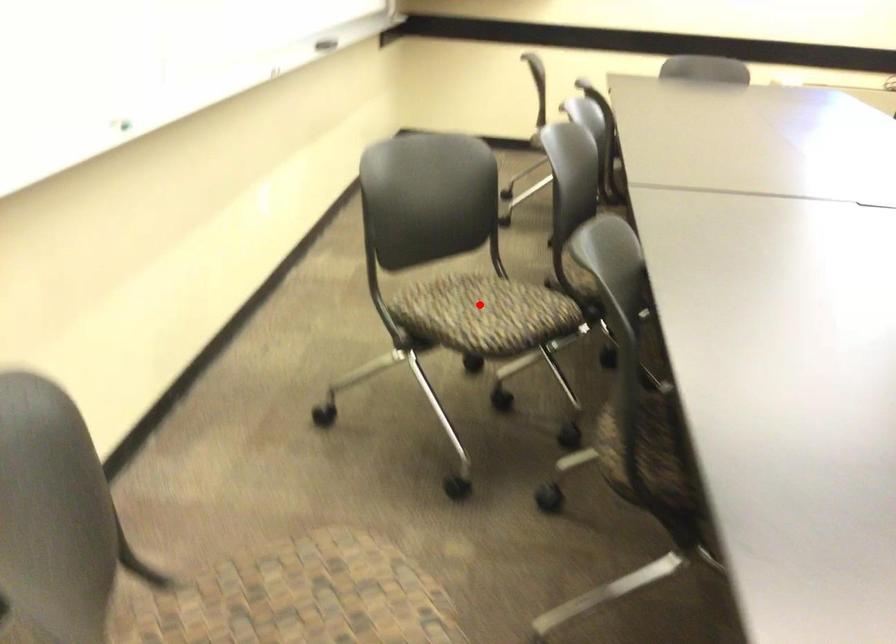
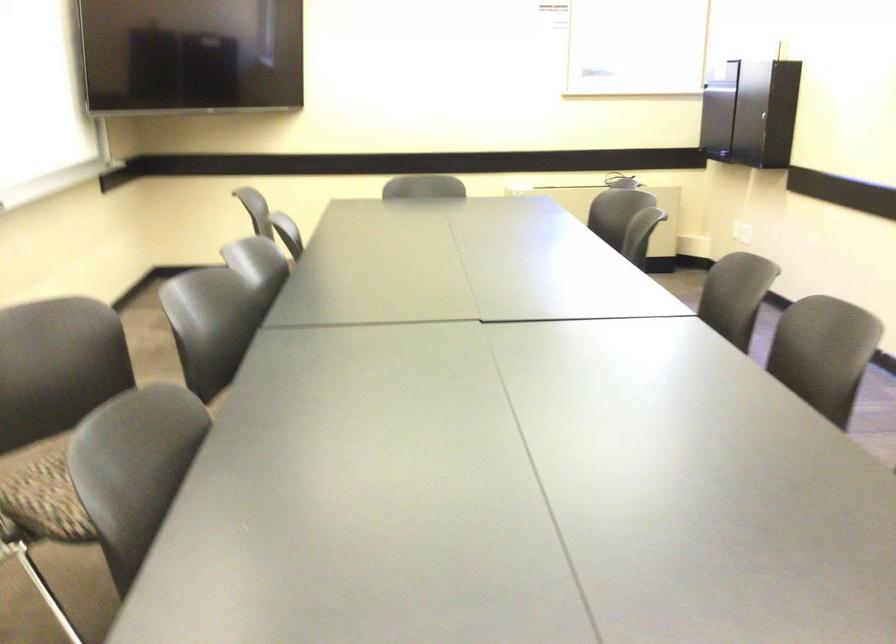
Question: I am providing you with two images of the same scene from different viewpoints. A red point is marked on the first image. Can you still see the location of the red point in image 2?

Choices:
 (A) Yes
 (B) No

Answer: (B)